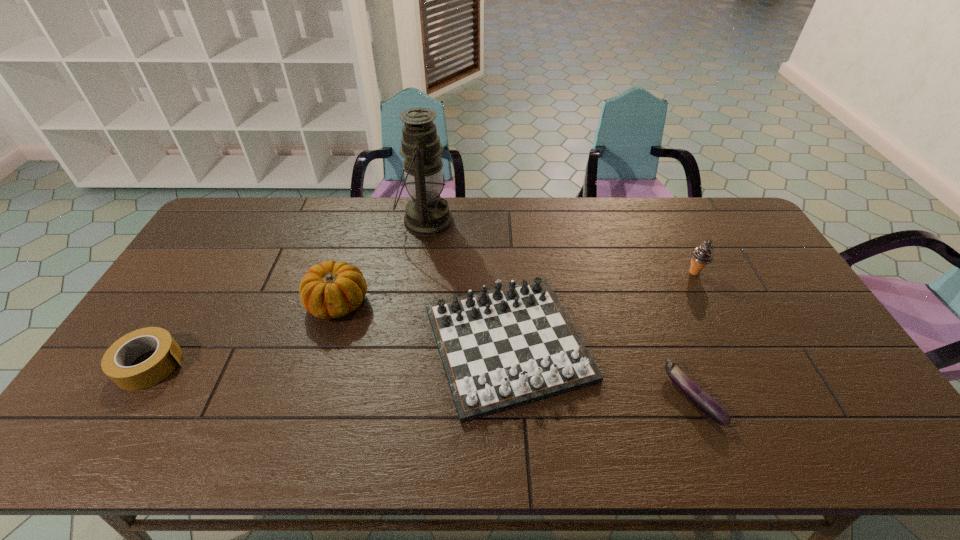
This screenshot has height=540, width=960. In order to click on the shortest object in this screenshot , I will do `click(706, 403)`.

Where is `free space located 0.330m on the front of the farthest object`? free space located 0.330m on the front of the farthest object is located at coordinates (412, 320).

This screenshot has width=960, height=540. In order to click on vacant area situated on the left of the second farthest object in this screenshot , I will do `click(604, 272)`.

Where is `free space located on the front of the fifth object from right to left`? The image size is (960, 540). free space located on the front of the fifth object from right to left is located at coordinates (317, 373).

Find the location of a particular element. This screenshot has width=960, height=540. vacant space located 0.130m on the right of the fourth tallest object is located at coordinates (640, 343).

Identify the location of free space located at the edge of the leftmost object. (326, 364).

The height and width of the screenshot is (540, 960). I want to click on free space located on the back of the fifth object from left to right, so coord(644,269).

Locate an element on the screen. object present at the far edge is located at coordinates (427, 214).

Locate an element on the screen. chessboard that is at the near edge is located at coordinates (502, 348).

Identify the location of eggplant that is at the near edge. (706, 403).